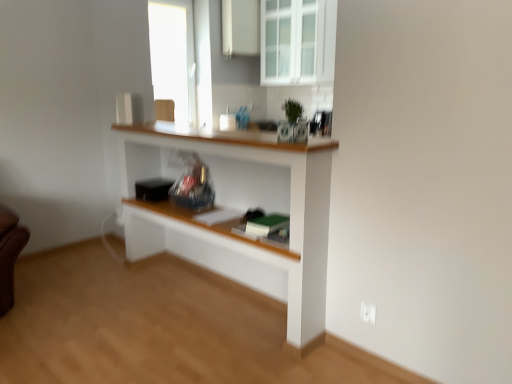
Question: Considering the relative sizes of white glossy cabinet at upper center and white glass cabinet at upper center in the image provided, is white glossy cabinet at upper center shorter than white glass cabinet at upper center?

Choices:
 (A) no
 (B) yes

Answer: (B)

Question: Can you confirm if white glossy cabinet at upper center is smaller than white glass cabinet at upper center?

Choices:
 (A) yes
 (B) no

Answer: (A)

Question: Is white glossy cabinet at upper center thinner than white glass cabinet at upper center?

Choices:
 (A) no
 (B) yes

Answer: (B)

Question: Is white glossy cabinet at upper center positioned before white glass cabinet at upper center?

Choices:
 (A) yes
 (B) no

Answer: (B)

Question: Is white glossy cabinet at upper center turned away from white glass cabinet at upper center?

Choices:
 (A) yes
 (B) no

Answer: (B)

Question: In terms of width, does white glossy cabinet at upper center look wider or thinner when compared to white wood shelf at center?

Choices:
 (A) wide
 (B) thin

Answer: (B)

Question: From a real-world perspective, is white glossy cabinet at upper center physically located above or below white wood shelf at center?

Choices:
 (A) above
 (B) below

Answer: (A)

Question: In the image, is white glossy cabinet at upper center on the left side or the right side of white wood shelf at center?

Choices:
 (A) left
 (B) right

Answer: (B)

Question: Is white glossy cabinet at upper center in front of or behind white wood shelf at center in the image?

Choices:
 (A) front
 (B) behind

Answer: (B)

Question: From their relative heights in the image, would you say white glossy cabinet at upper center is taller or shorter than white glass cabinet at upper center?

Choices:
 (A) short
 (B) tall

Answer: (A)

Question: Considering their positions, is white glossy cabinet at upper center located in front of or behind white glass cabinet at upper center?

Choices:
 (A) front
 (B) behind

Answer: (B)

Question: From the image's perspective, relative to white glass cabinet at upper center, is white glossy cabinet at upper center above or below?

Choices:
 (A) below
 (B) above

Answer: (B)

Question: Looking at their shapes, would you say white glossy cabinet at upper center is wider or thinner than white glass cabinet at upper center?

Choices:
 (A) wide
 (B) thin

Answer: (B)

Question: From a real-world perspective, is white plastic electric outlet at lower right positioned above or below white wood shelf at center?

Choices:
 (A) above
 (B) below

Answer: (B)

Question: From the image's perspective, is white plastic electric outlet at lower right positioned above or below white wood shelf at center?

Choices:
 (A) above
 (B) below

Answer: (B)